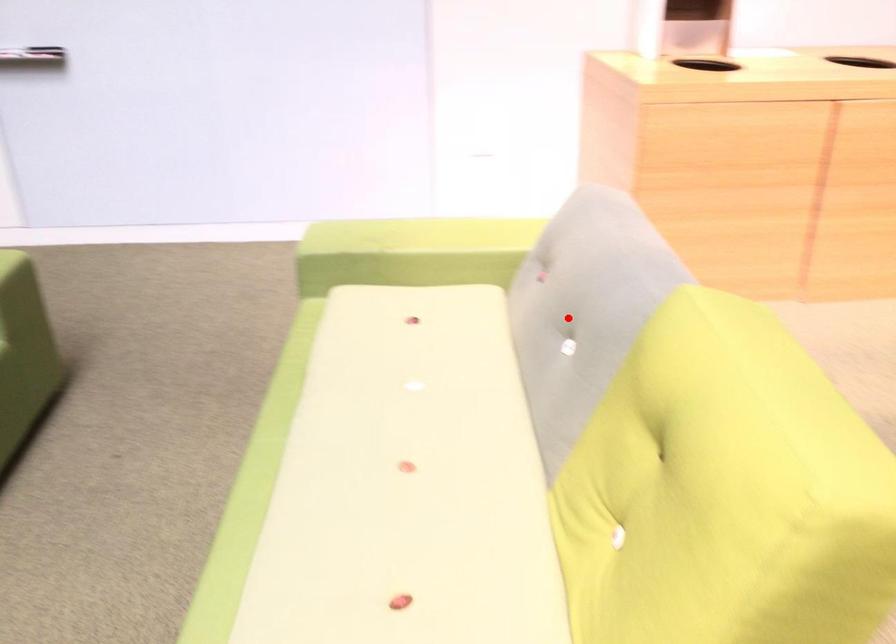
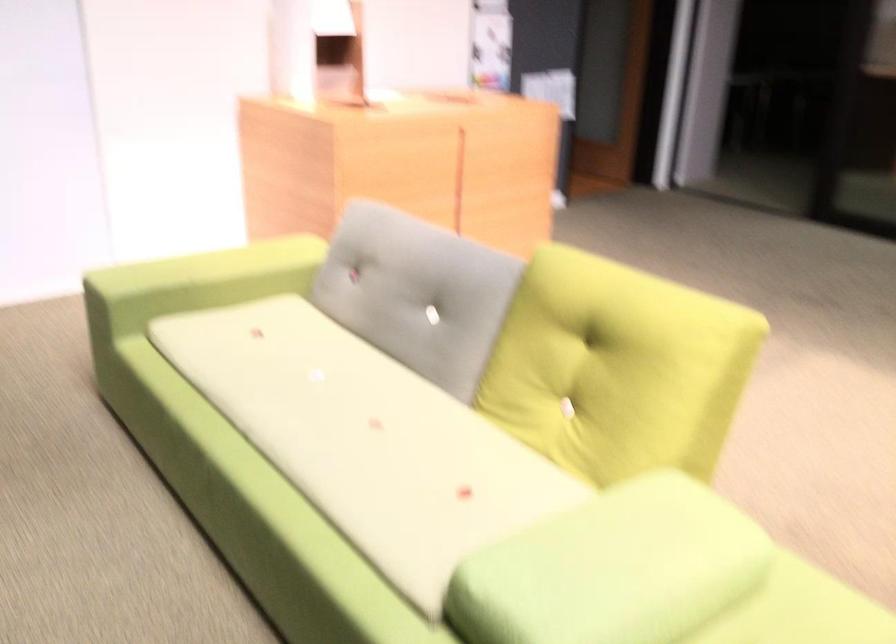
Question: I am providing you with two images of the same scene from different viewpoints. Given a red point in image1, look at the same physical point in image2. Is it:

Choices:
 (A) Closer to the viewpoint
 (B) Farther from the viewpoint

Answer: (B)